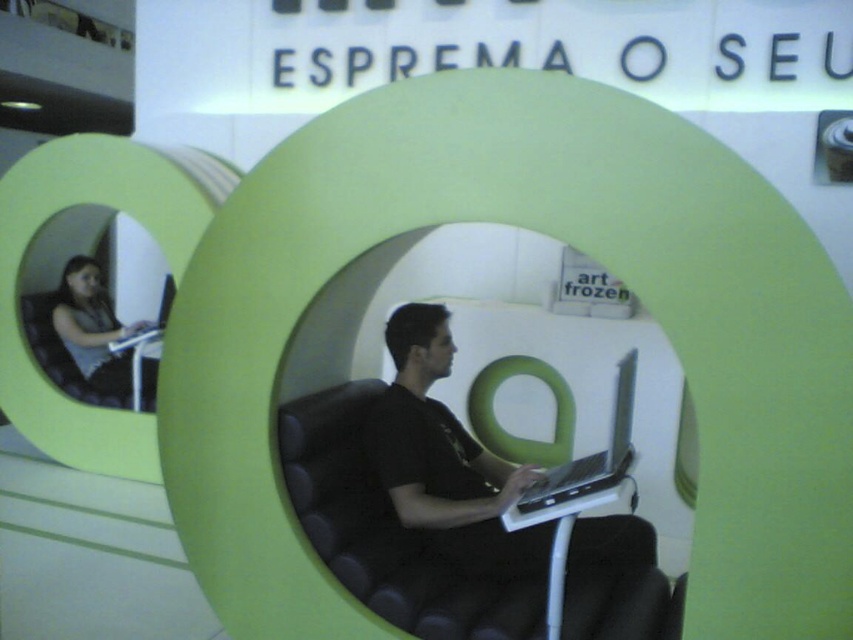
Question: Which object is farther from the camera taking this photo?

Choices:
 (A) matte black laptop at left
 (B) black leather chair at center

Answer: (A)

Question: Is matte black laptop at left wider than silver metallic laptop at center?

Choices:
 (A) yes
 (B) no

Answer: (A)

Question: Is black leather chair at center below silver metallic laptop at center?

Choices:
 (A) yes
 (B) no

Answer: (A)

Question: Among these points, which one is farthest from the camera?

Choices:
 (A) click(88, 317)
 (B) click(511, 532)
 (C) click(628, 403)
 (D) click(463, 572)

Answer: (A)

Question: Is black leather chair at center further to the viewer compared to silver metallic laptop at center?

Choices:
 (A) no
 (B) yes

Answer: (B)

Question: Which of the following is the closest to the observer?

Choices:
 (A) coord(573,493)
 (B) coord(352,396)

Answer: (A)